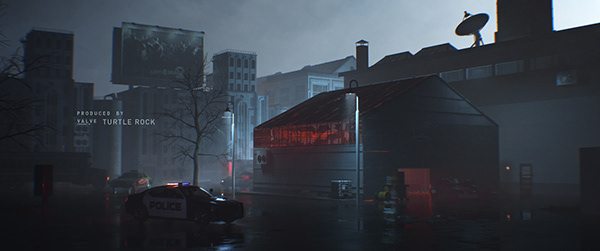
Where is `light`? This screenshot has width=600, height=251. light is located at coordinates (328, 135).